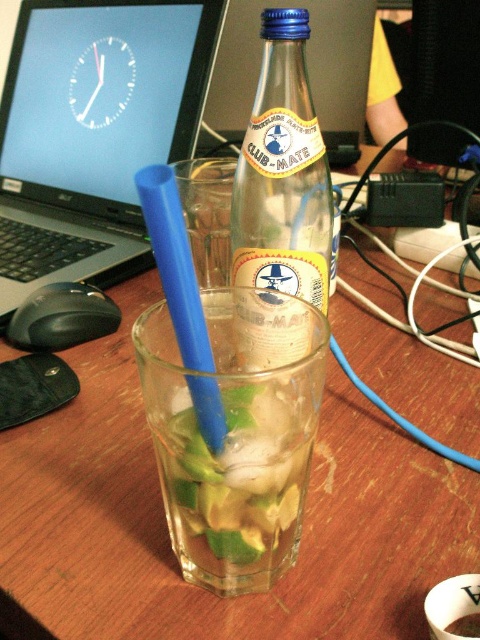
Question: Where is black plastic laptop at upper left located in relation to clear glass bottle at center in the image?

Choices:
 (A) below
 (B) above

Answer: (B)

Question: Among these points, which one is farthest from the camera?

Choices:
 (A) (109, 125)
 (B) (226, 433)
 (C) (278, 177)

Answer: (A)

Question: Which of the following is the farthest from the observer?

Choices:
 (A) blue plastic straw at center
 (B) black plastic laptop at upper left
 (C) clear glass bottle at center

Answer: (B)

Question: From the image, what is the correct spatial relationship of black plastic laptop at upper left in relation to clear glass bottle at center?

Choices:
 (A) below
 (B) above

Answer: (B)

Question: Which object is positioned farthest from the clear glass bottle at center?

Choices:
 (A) blue plastic straw at center
 (B) black plastic laptop at upper left

Answer: (B)

Question: Is the position of clear glass bottle at center more distant than that of blue plastic straw at center?

Choices:
 (A) no
 (B) yes

Answer: (B)